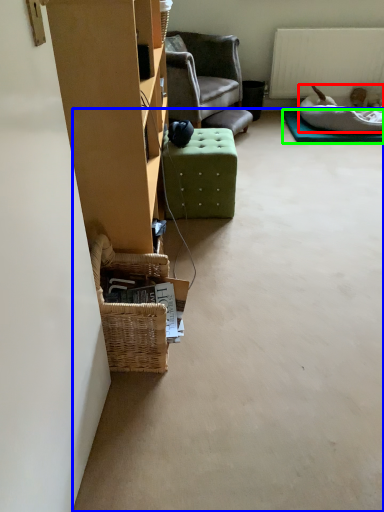
Question: Which is nearer to the dog bed (highlighted by a red box)? concrete (highlighted by a blue box) or mat (highlighted by a green box).

Choices:
 (A) concrete
 (B) mat

Answer: (B)